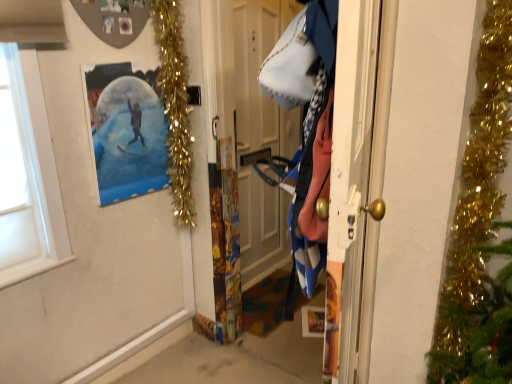
Question: Is wooden door at center at the right side of gold tinsel garland at upper left?

Choices:
 (A) no
 (B) yes

Answer: (B)

Question: Is wooden door at center oriented away from gold tinsel garland at upper left?

Choices:
 (A) no
 (B) yes

Answer: (A)

Question: Is there a large distance between wooden door at center and gold tinsel garland at upper left?

Choices:
 (A) yes
 (B) no

Answer: (B)

Question: Considering the relative sizes of wooden door at center and gold tinsel garland at upper left in the image provided, is wooden door at center wider than gold tinsel garland at upper left?

Choices:
 (A) yes
 (B) no

Answer: (B)

Question: Considering the relative sizes of wooden door at center and gold tinsel garland at upper left in the image provided, is wooden door at center shorter than gold tinsel garland at upper left?

Choices:
 (A) no
 (B) yes

Answer: (A)

Question: From the image's perspective, relative to wooden door at center, is gold tinsel garland at upper left above or below?

Choices:
 (A) below
 (B) above

Answer: (B)

Question: In the image, is gold tinsel garland at upper left on the left side or the right side of wooden door at center?

Choices:
 (A) left
 (B) right

Answer: (A)

Question: Looking at their shapes, would you say gold tinsel garland at upper left is wider or thinner than wooden door at center?

Choices:
 (A) thin
 (B) wide

Answer: (B)

Question: Is gold tinsel garland at upper left taller or shorter than wooden door at center?

Choices:
 (A) tall
 (B) short

Answer: (B)

Question: Considering the positions of wooden door at center and gold tinsel garland at upper left in the image, is wooden door at center bigger or smaller than gold tinsel garland at upper left?

Choices:
 (A) big
 (B) small

Answer: (A)

Question: Considering the positions of wooden door at center and gold tinsel garland at upper left in the image, is wooden door at center wider or thinner than gold tinsel garland at upper left?

Choices:
 (A) wide
 (B) thin

Answer: (B)

Question: Relative to gold tinsel garland at upper left, is wooden door at center in front or behind?

Choices:
 (A) behind
 (B) front

Answer: (A)

Question: In terms of height, does wooden door at center look taller or shorter compared to gold tinsel garland at upper left?

Choices:
 (A) short
 (B) tall

Answer: (B)

Question: Is point (111, 64) closer or farther from the camera than point (316, 49)?

Choices:
 (A) closer
 (B) farther

Answer: (B)

Question: From their relative heights in the image, would you say polka dot paper snow globe at upper left is taller or shorter than blue denim jacket at right?

Choices:
 (A) short
 (B) tall

Answer: (A)